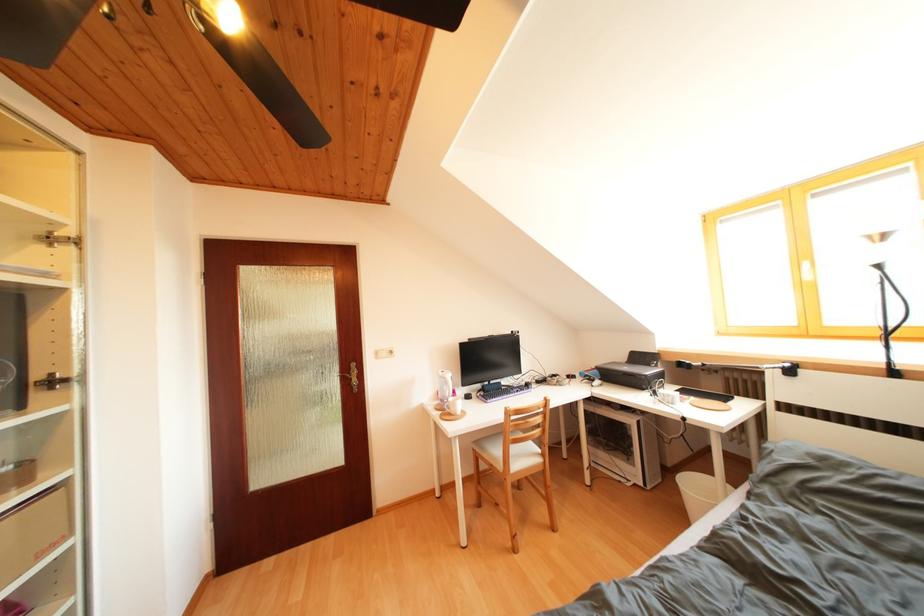
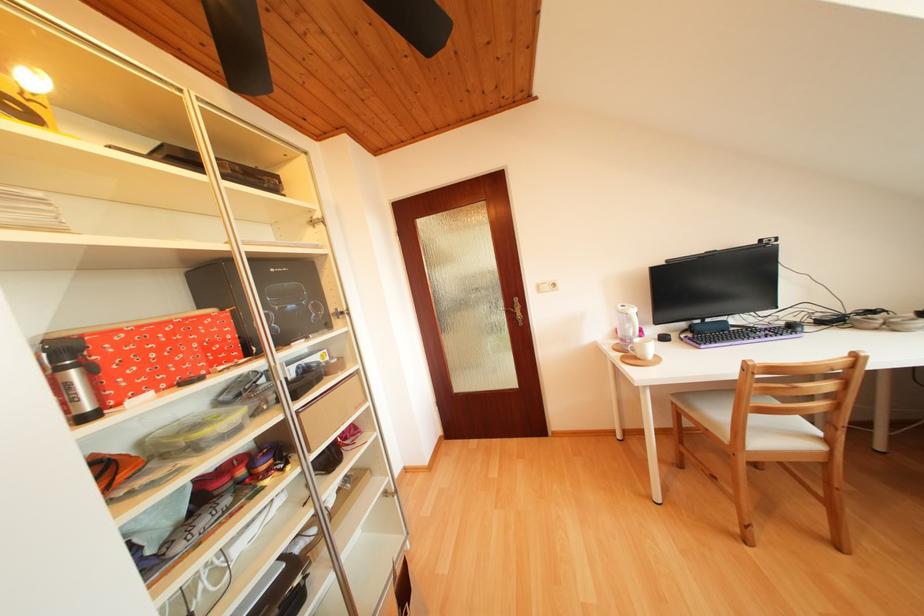
In the second image, find the point that corresponds to the point at 562,535 in the first image.

(847, 553)